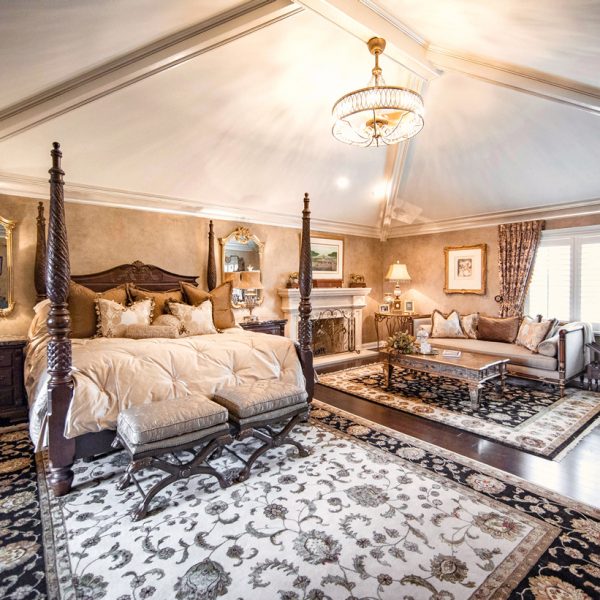
You are a GUI agent. You are given a task and a screenshot of the screen. Output one action in this format:
    pyautogui.click(x=<x>, y=<y>)
    Task: Click on the floor
    The image size is (600, 600).
    Given the screenshot: What is the action you would take?
    pyautogui.click(x=570, y=493), pyautogui.click(x=570, y=487)